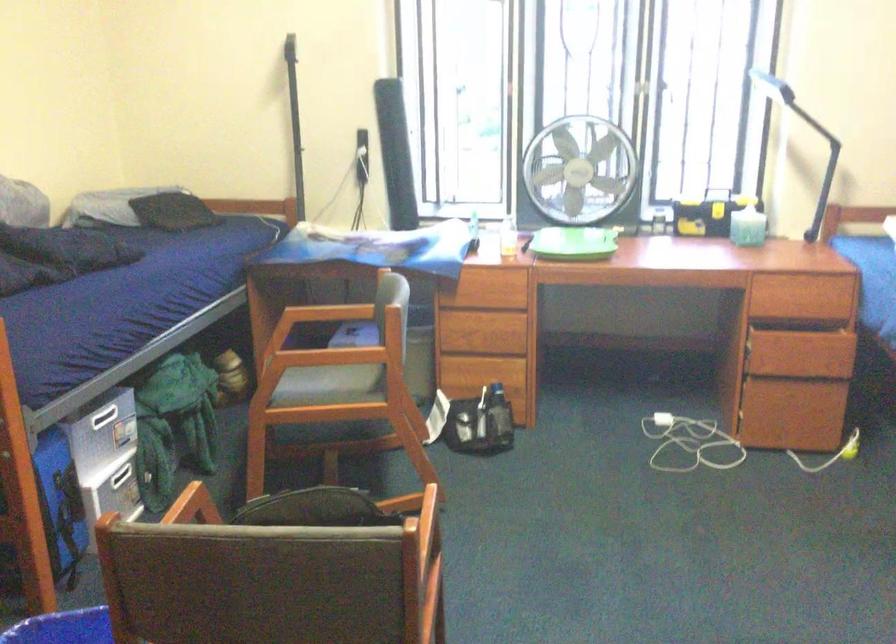
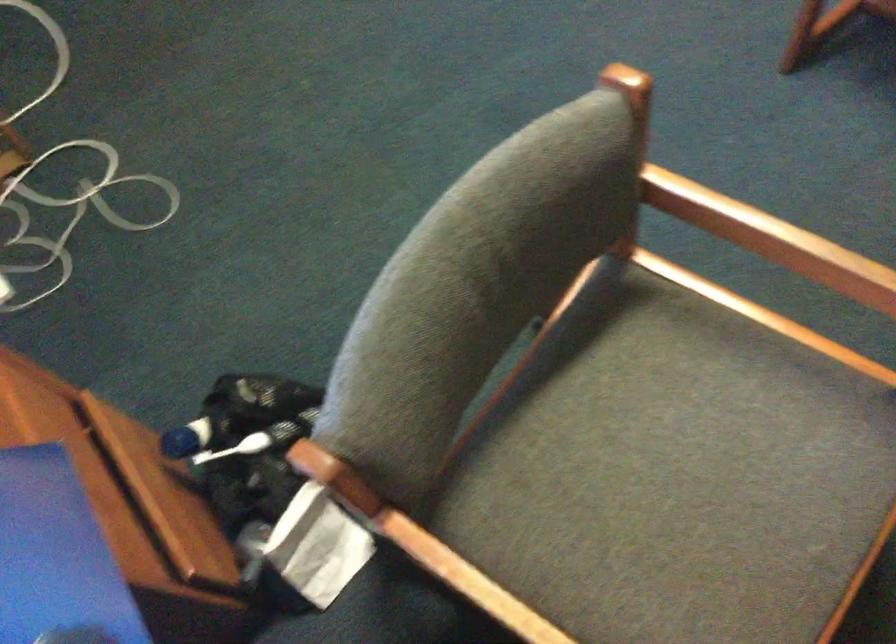
Where in the second image is the point corresponding to the point at 364,312 from the first image?

(433, 576)